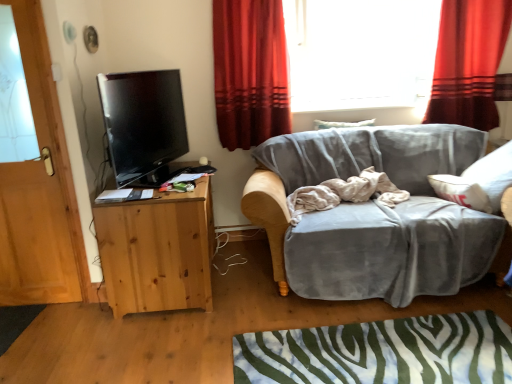
At what (x,y) coordinates should I click in order to perform the action: click on free space below green and white zebra-patterned rug at lower center (from a real-world perspective). Please return your answer as a coordinate pair (x, y). The height and width of the screenshot is (384, 512). Looking at the image, I should click on (397, 352).